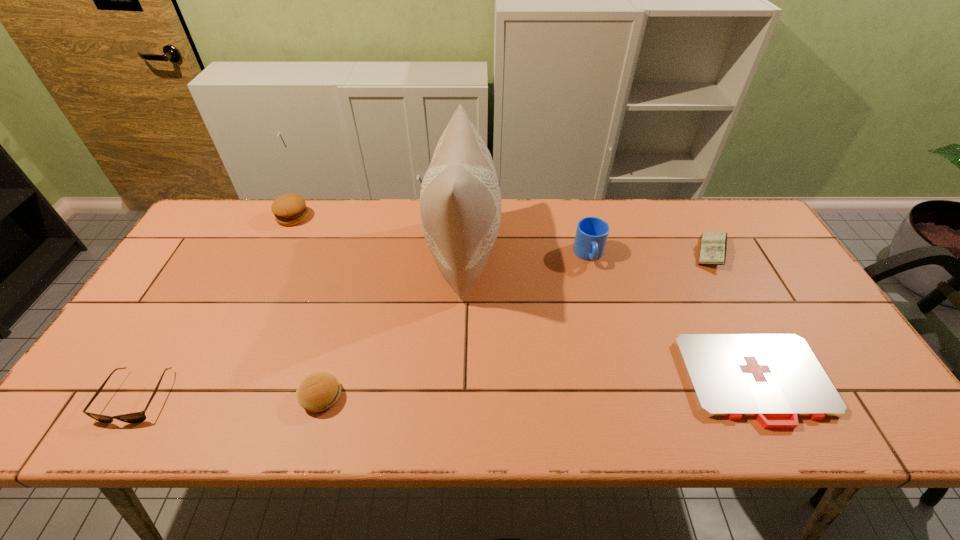
Identify the location of free spot between the shortest object and the patty. (539, 388).

The height and width of the screenshot is (540, 960). Identify the location of free space between the tallest object and the hamburger. (378, 234).

This screenshot has width=960, height=540. What are the coordinates of `free space between the hamburger and the shortest object` in the screenshot? It's located at (524, 299).

The height and width of the screenshot is (540, 960). Find the location of `free point between the shortest object and the sixth shortest object`. free point between the shortest object and the sixth shortest object is located at coordinates (672, 318).

Locate which object ranks in proximity to the shortest object. Please provide its 2D coordinates. Your answer should be formatted as a tuple, i.e. [(x, y)], where the tuple contains the x and y coordinates of a point satisfying the conditions above.

[(713, 247)]

Where is `the second closest object to the sixth tallest object`? the second closest object to the sixth tallest object is located at coordinates (289, 209).

Find the location of a particular element. vacant space that satisfies the following two spatial constraints: 1. on the front side of the sixth object from right to left; 2. on the left side of the diary is located at coordinates (276, 252).

Find the location of a particular element. This screenshot has height=540, width=960. vacant region that satisfies the following two spatial constraints: 1. on the front side of the fourth object from right to left; 2. on the lenses of the sixth tallest object is located at coordinates (458, 396).